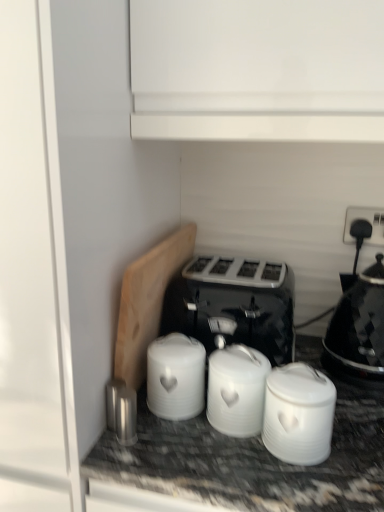
Question: Are black glossy kettle at right and white matte canisters at center, which is the third appliance in left-to-right order, making contact?

Choices:
 (A) yes
 (B) no

Answer: (B)

Question: From the image's perspective, is black glossy kettle at right under white matte canisters at center, which is the third appliance in left-to-right order?

Choices:
 (A) no
 (B) yes

Answer: (A)

Question: Does black glossy kettle at right come behind white matte canisters at center, the second appliance positioned from the right?

Choices:
 (A) yes
 (B) no

Answer: (A)

Question: Can you confirm if black glossy kettle at right is bigger than white matte canisters at center, which is the third appliance in left-to-right order?

Choices:
 (A) no
 (B) yes

Answer: (B)

Question: From a real-world perspective, is black glossy kettle at right physically below white matte canisters at center, the second appliance positioned from the right?

Choices:
 (A) yes
 (B) no

Answer: (B)

Question: Do you think black plastic toaster at center is within black plastic socket at upper right, or outside of it?

Choices:
 (A) outside
 (B) inside

Answer: (A)

Question: From a real-world perspective, is black plastic toaster at center above or below black plastic socket at upper right?

Choices:
 (A) below
 (B) above

Answer: (A)

Question: Does point (274, 297) appear closer or farther from the camera than point (377, 239)?

Choices:
 (A) closer
 (B) farther

Answer: (A)

Question: From their relative heights in the image, would you say black plastic toaster at center is taller or shorter than black plastic socket at upper right?

Choices:
 (A) tall
 (B) short

Answer: (A)

Question: Do you think shiny metallic canister at lower center, positioned as the 1th appliance in left-to-right order, is within black glossy kettle at right, or outside of it?

Choices:
 (A) outside
 (B) inside

Answer: (A)

Question: Considering the positions of shiny metallic canister at lower center, positioned as the 1th appliance in left-to-right order, and black glossy kettle at right in the image, is shiny metallic canister at lower center, positioned as the 1th appliance in left-to-right order, taller or shorter than black glossy kettle at right?

Choices:
 (A) short
 (B) tall

Answer: (A)

Question: From a real-world perspective, is shiny metallic canister at lower center, positioned as the 1th appliance in left-to-right order, physically located above or below black glossy kettle at right?

Choices:
 (A) above
 (B) below

Answer: (B)

Question: In terms of size, does shiny metallic canister at lower center, placed as the 4th appliance when sorted from right to left, appear bigger or smaller than black glossy kettle at right?

Choices:
 (A) big
 (B) small

Answer: (B)

Question: Is point (228, 374) positioned closer to the camera than point (339, 340)?

Choices:
 (A) farther
 (B) closer

Answer: (B)

Question: Considering the positions of white matte canisters at center, which is the third appliance in left-to-right order, and black glossy kettle at right in the image, is white matte canisters at center, which is the third appliance in left-to-right order, bigger or smaller than black glossy kettle at right?

Choices:
 (A) big
 (B) small

Answer: (B)